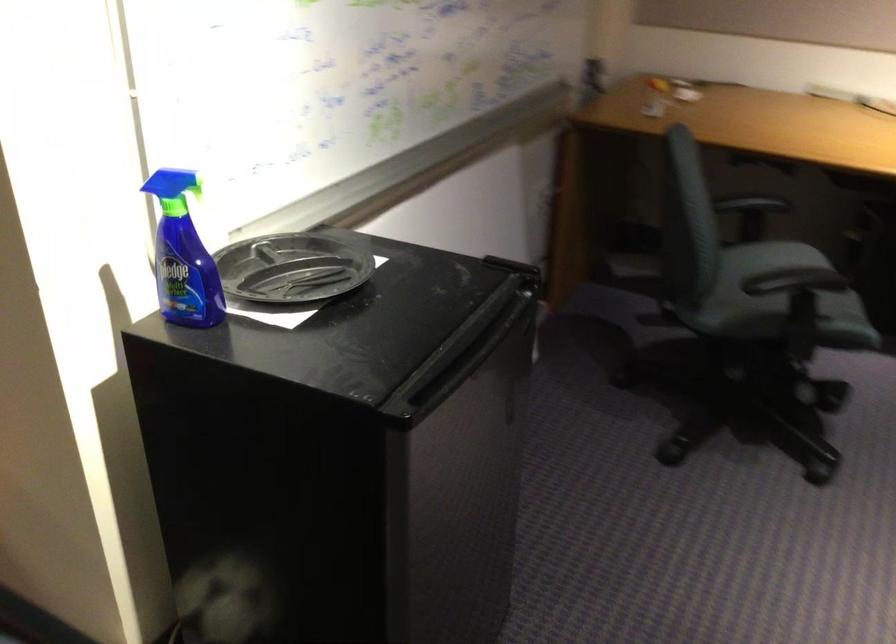
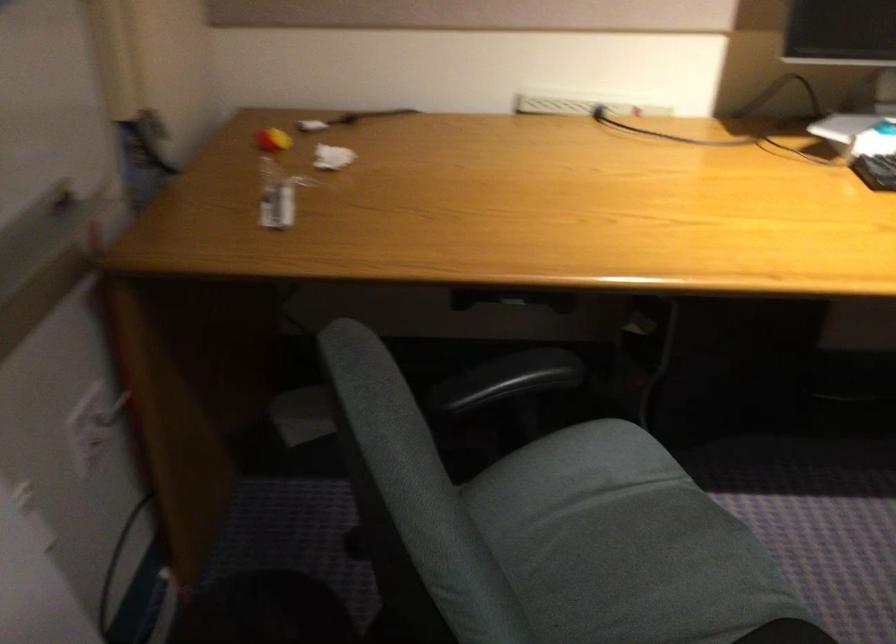
Question: What movement of the cameraman would produce the second image?

Choices:
 (A) Left
 (B) Right
 (C) Forward
 (D) Backward

Answer: (C)